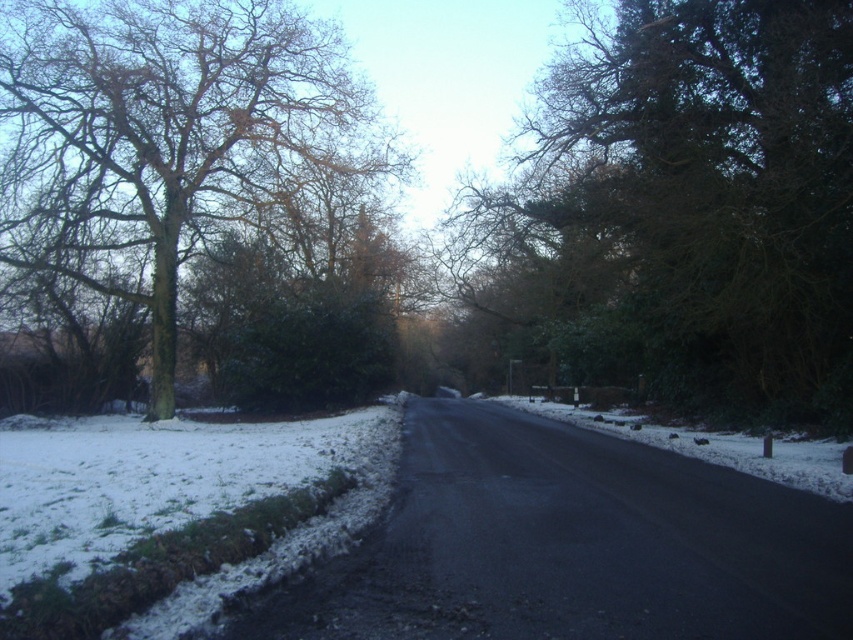
You are a landscape architect designing a walking path between the green leafy tree at center and the green leafy tree at left. The path must be straight and wide enough for two people to walk side by side. If each person requires 0.5 meters of space, what is the minimum width required for the path?

The minimum width required for the path between the green leafy tree at center and the green leafy tree at left is 1 meter, as two people each needing 0.5 meters of space would require a total of 1 meter combined. The distance between the trees is 15.21 meters, which is the length of the path, but the width only needs to accommodate the two people side by side.

Looking at this image, you are standing on the road in the winter scene and want to know which green leafy tree is closer to you. Which one is closer between the green leafy tree at center and the green leafy tree at left?

The green leafy tree at center is closer to you because it is in front of the green leafy tree at left.

You are standing on the road in the winter scene and want to walk towards the green leafy tree at center. Which direction should you go relative to the green leafy tree at left?

You should walk towards the right side of the green leafy tree at left to reach the green leafy tree at center because the green leafy tree at center is positioned on the right side of green leafy tree at left.